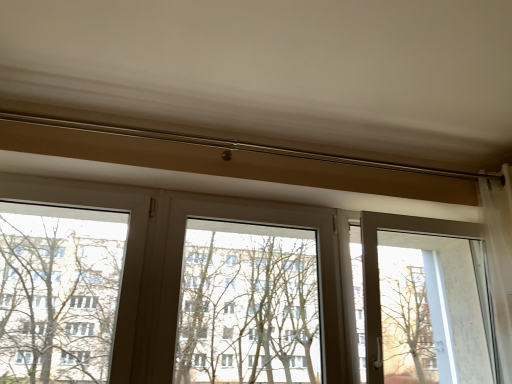
What is the approximate width of transparent plastic window screen at center?

The width of transparent plastic window screen at center is 5.16 inches.

Locate an element on the screen. This screenshot has height=384, width=512. transparent glass screen door at right is located at coordinates click(425, 301).

Is transparent glass screen door at right surrounding green leafy tree at left?

No, green leafy tree at left is not inside transparent glass screen door at right.

From a real-world perspective, relative to green leafy tree at left, is transparent glass screen door at right vertically above or below?

transparent glass screen door at right is above green leafy tree at left.

Is transparent glass screen door at right shorter than green leafy tree at left?

Incorrect, the height of transparent glass screen door at right does not fall short of that of green leafy tree at left.

Which of these two, transparent plastic window screen at center or green leafy tree at left, is bigger?

transparent plastic window screen at center is bigger.

From the image's perspective, between transparent plastic window screen at center and green leafy tree at left, who is located below?

transparent plastic window screen at center, from the image's perspective.

Considering the positions of objects transparent plastic window screen at center and green leafy tree at left in the image provided, who is in front, transparent plastic window screen at center or green leafy tree at left?

green leafy tree at left.

From a real-world perspective, which is physically above, transparent plastic window screen at center or green leafy tree at left?

green leafy tree at left, from a real-world perspective.

From a real-world perspective, is green leafy tree at left under transparent glass screen door at right?

Yes.

From the picture: Is green leafy tree at left beside transparent glass screen door at right?

No, green leafy tree at left is not next to transparent glass screen door at right.

Between green leafy tree at left and transparent glass screen door at right, which one appears on the right side from the viewer's perspective?

→ transparent glass screen door at right.

Is transparent plastic window screen at center not within transparent glass screen door at right?

transparent plastic window screen at center is positioned outside transparent glass screen door at right.

Locate an element on the screen. window screen on the left of the transparent glass screen door at right is located at coordinates (248, 305).

Is transparent plastic window screen at center positioned behind transparent glass screen door at right?

No, it is not.

Considering the relative sizes of transparent plastic window screen at center and transparent glass screen door at right in the image provided, is transparent plastic window screen at center smaller than transparent glass screen door at right?

Indeed, transparent plastic window screen at center has a smaller size compared to transparent glass screen door at right.

In the scene shown: Between green leafy tree at left and transparent plastic window screen at center, which one is positioned in front?

green leafy tree at left is more forward.

Is point (30, 212) less distant than point (266, 305)?

Yes, it is.

Is green leafy tree at left far from transparent plastic window screen at center?

Yes, green leafy tree at left and transparent plastic window screen at center are quite far apart.

Is green leafy tree at left looking in the opposite direction of transparent plastic window screen at center?

green leafy tree at left does not have its back to transparent plastic window screen at center.

Which object is positioned more to the left, transparent glass screen door at right or transparent plastic window screen at center?

transparent plastic window screen at center is more to the left.

Where is `window screen on the left of transparent glass screen door at right`? This screenshot has height=384, width=512. window screen on the left of transparent glass screen door at right is located at coordinates click(248, 305).

From a real-world perspective, who is located higher, transparent glass screen door at right or transparent plastic window screen at center?

transparent glass screen door at right, from a real-world perspective.

Image resolution: width=512 pixels, height=384 pixels. I want to click on tree below the transparent glass screen door at right (from a real-world perspective), so click(58, 292).

Locate an element on the screen. This screenshot has width=512, height=384. tree located on the left of transparent plastic window screen at center is located at coordinates (58, 292).

When comparing their distances from transparent glass screen door at right, does transparent plastic window screen at center or green leafy tree at left seem further?

green leafy tree at left is positioned further to the anchor transparent glass screen door at right.

Considering their positions, is green leafy tree at left positioned closer to transparent glass screen door at right than transparent plastic window screen at center?

Based on the image, transparent plastic window screen at center appears to be nearer to transparent glass screen door at right.

In the scene shown: Estimate the real-world distances between objects in this image. Which object is further from green leafy tree at left, transparent glass screen door at right or transparent plastic window screen at center?

transparent glass screen door at right is positioned further to the anchor green leafy tree at left.

From the image, which object appears to be nearer to transparent plastic window screen at center, green leafy tree at left or transparent glass screen door at right?

Among the two, transparent glass screen door at right is located nearer to transparent plastic window screen at center.

Looking at the image, which one is located further to green leafy tree at left, transparent plastic window screen at center or transparent glass screen door at right?

transparent glass screen door at right.

From the image, which object appears to be nearer to transparent plastic window screen at center, transparent glass screen door at right or green leafy tree at left?

Based on the image, transparent glass screen door at right appears to be nearer to transparent plastic window screen at center.

Locate an element on the screen. window screen between green leafy tree at left and transparent glass screen door at right in the horizontal direction is located at coordinates (248, 305).